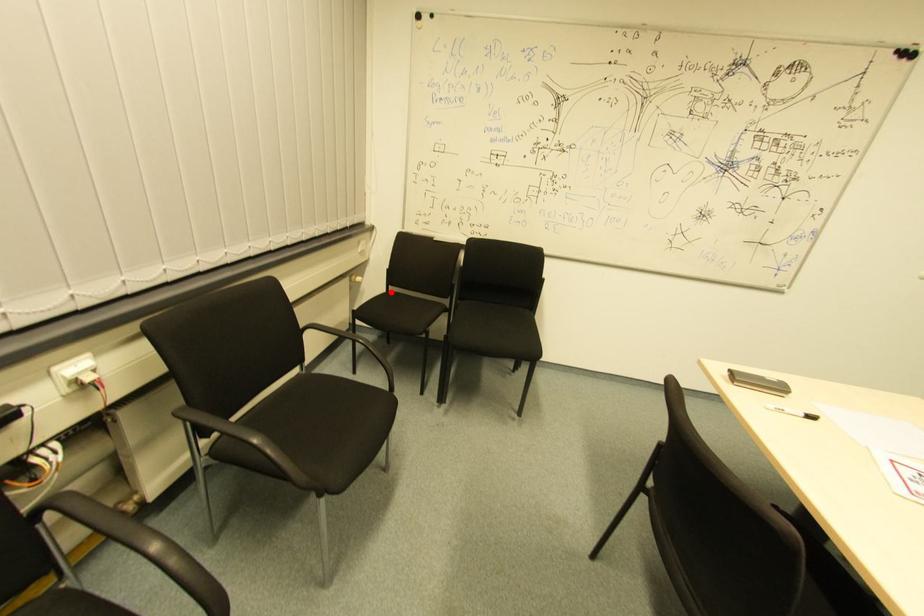
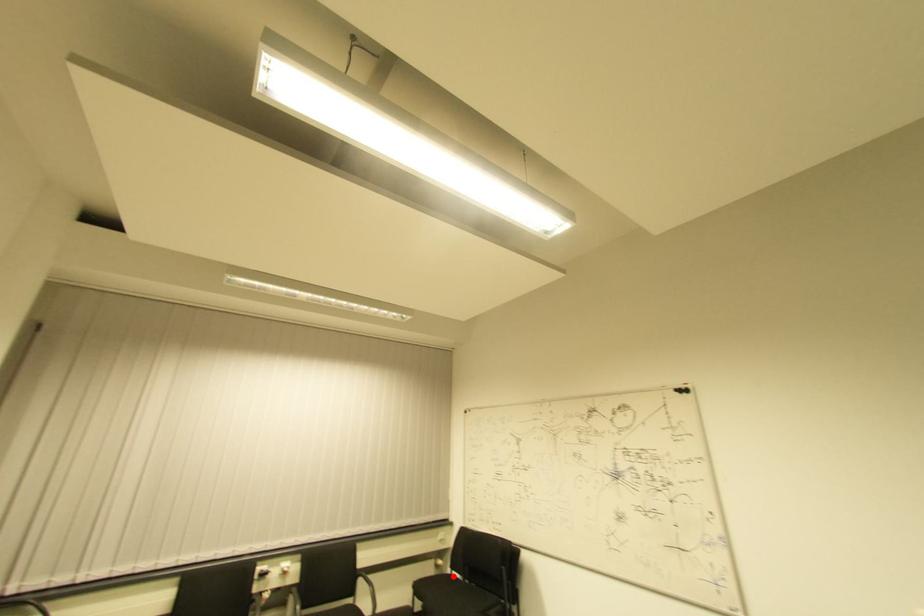
I am providing you with two images of the same scene from different viewpoints. A red point is marked on the first image and another point is marked on the second image. Do the highlighted points in image1 and image2 indicate the same real-world spot?

Yes